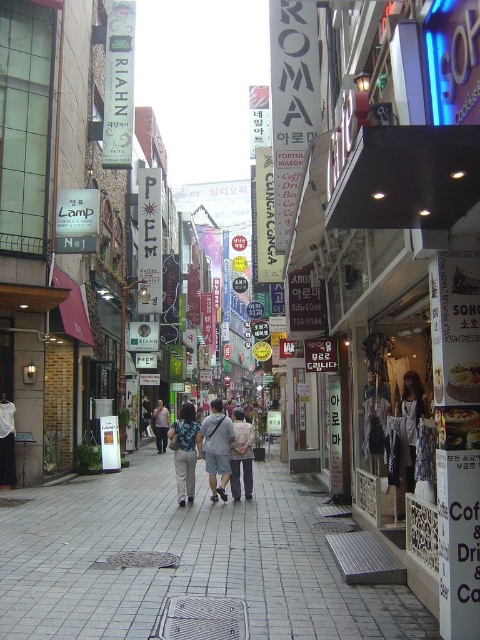
Question: Which point appears farthest from the camera in this image?

Choices:
 (A) (168, 428)
 (B) (192, 406)

Answer: (A)

Question: Among these objects, which one is farthest from the camera?

Choices:
 (A) light blue denim pants at center
 (B) light brown fabric pants at center
 (C) light blue denim shorts at center
 (D) light beige fabric pants at center

Answer: (A)

Question: Which object appears farthest from the camera in this image?

Choices:
 (A) light brown fabric pants at center
 (B) blue textured shirt at center

Answer: (B)

Question: Is light brown fabric pants at center thinner than blue textured shirt at center?

Choices:
 (A) yes
 (B) no

Answer: (B)

Question: Is light blue denim shorts at center further to camera compared to light beige fabric pants at center?

Choices:
 (A) no
 (B) yes

Answer: (A)

Question: Is gray tile pavement at center in front of light blue denim pants at center?

Choices:
 (A) no
 (B) yes

Answer: (B)